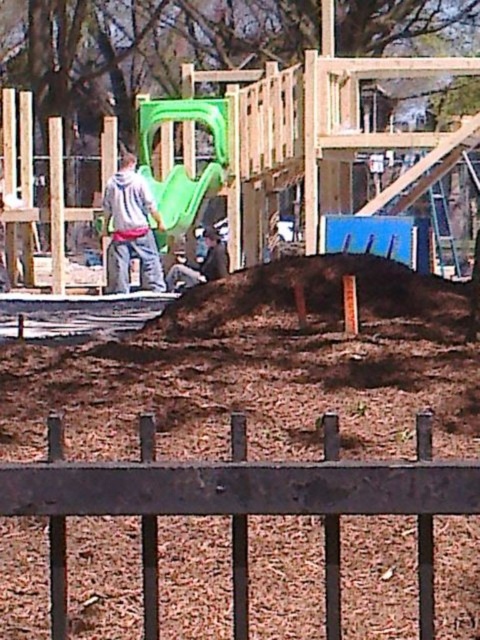
You are a construction worker who needs to access the brown mulch at center. Is the black wrought iron fence at lower center blocking your path to it?

The black wrought iron fence at lower center is positioned under the brown mulch at center, which means the fence is below the mulch in the scene. Since the mulch is above the fence, you can access the mulch without the fence blocking your path.